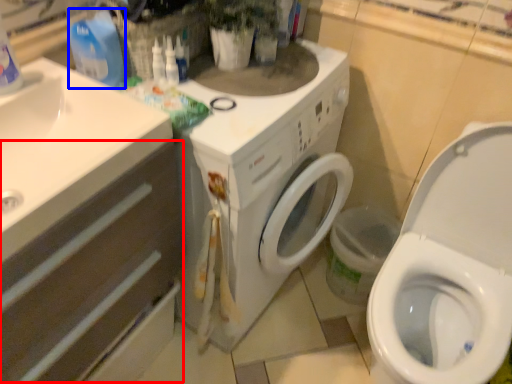
Question: Which object is closer to the camera taking this photo, drawer (highlighted by a red box) or cleaning product (highlighted by a blue box)?

Choices:
 (A) drawer
 (B) cleaning product

Answer: (A)